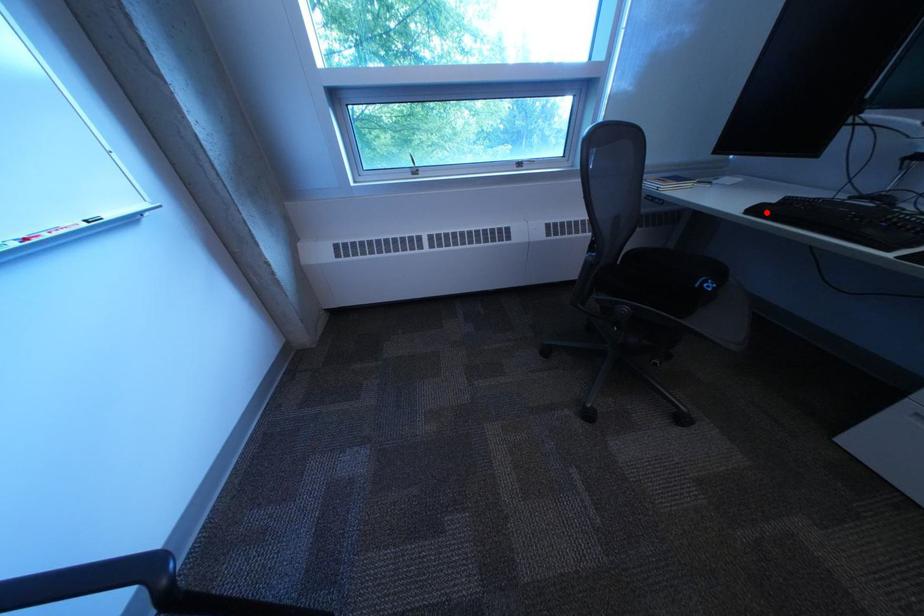
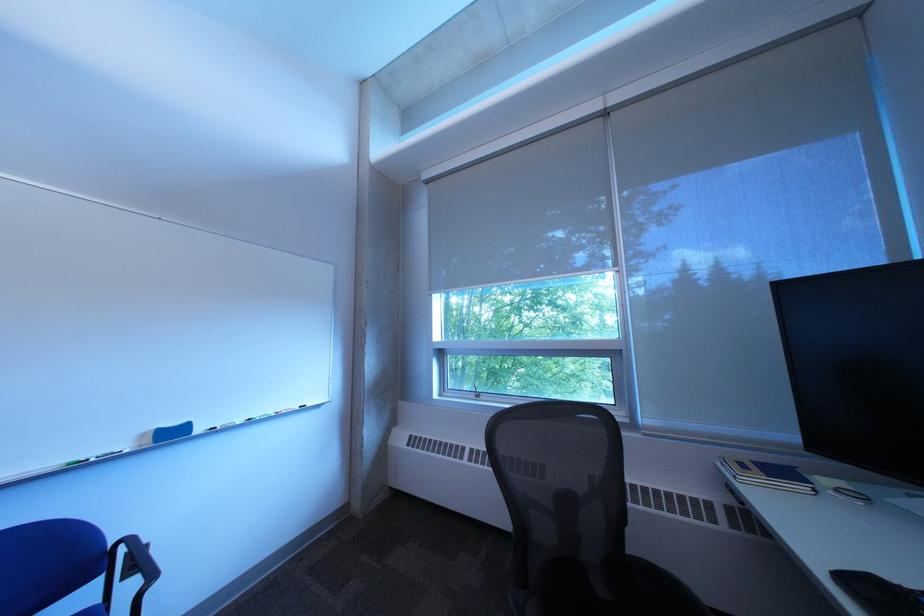
Where in the second image is the point corresponding to the highlighted location from the first image?

(860, 582)